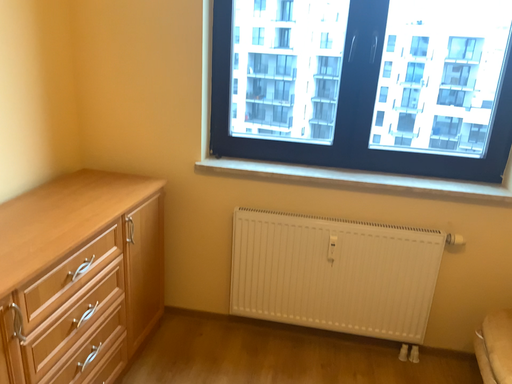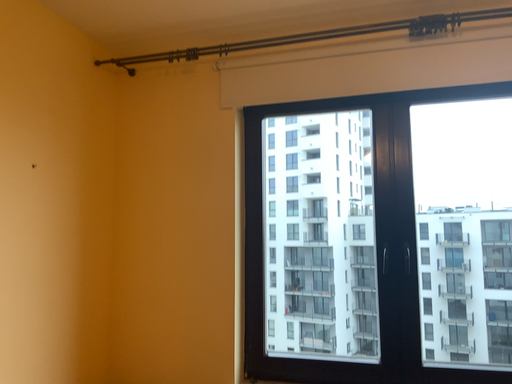
Question: Which way did the camera rotate in the video?

Choices:
 (A) rotated downward
 (B) rotated upward

Answer: (B)